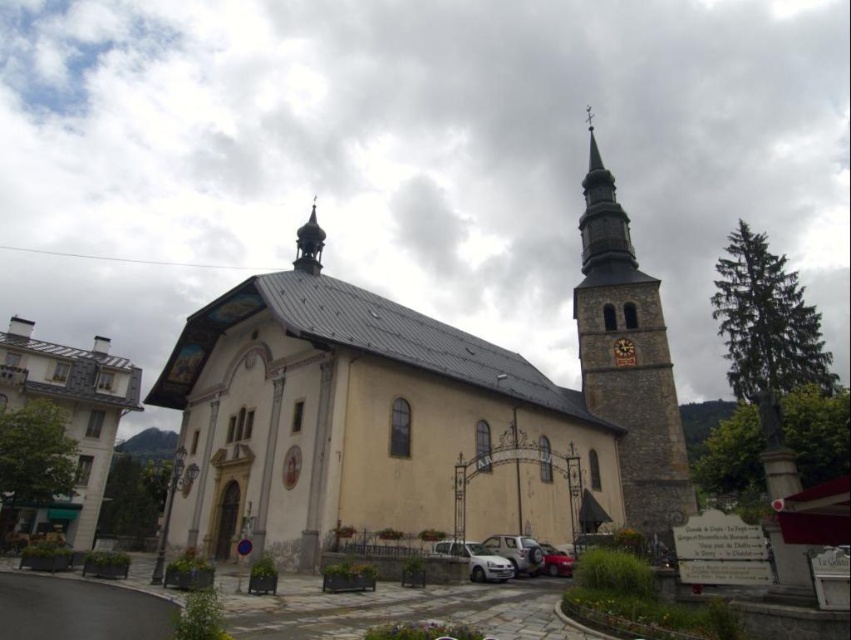
Question: Among these objects, which one is nearest to the camera?

Choices:
 (A) white matte car at lower center
 (B) metallic silver car at lower center
 (C) yellow stone church at center
 (D) stone steeple at upper right

Answer: (C)

Question: Observing the image, what is the correct spatial positioning of yellow stone church at center in reference to silver metallic car at lower center?

Choices:
 (A) left
 (B) right

Answer: (B)

Question: Which is farther from the white matte car at lower center?

Choices:
 (A) metallic silver car at lower center
 (B) gold textured dome at upper center
 (C) yellow stone church at center

Answer: (B)

Question: Does yellow stone church at center have a larger size compared to metallic silver car at lower center?

Choices:
 (A) no
 (B) yes

Answer: (B)

Question: Is white matte car at lower center further to camera compared to silver metallic car at lower center?

Choices:
 (A) yes
 (B) no

Answer: (B)

Question: Which is nearer to the white matte car at lower center?

Choices:
 (A) gold textured dome at upper center
 (B) stone steeple at upper right

Answer: (B)